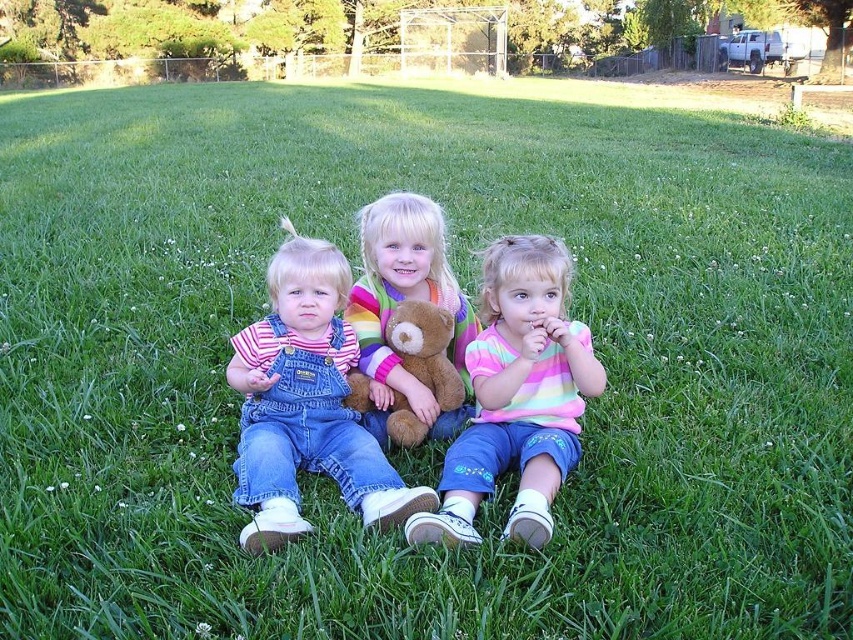
You are a photographer trying to capture a group photo of the children. You want to ensure that both the striped cotton shirt at center and the multicolored striped shirt at center are clearly visible in the photo. Given their distance apart, what is the minimum focal length you should use for your camera lens to ensure both shirts are in focus?

The striped cotton shirt at center is 17.42 inches away from the multicolored striped shirt at center. To ensure both are in focus, the minimum focal length required would depend on the sensor size of the camera and the acceptable circle of confusion. However, a general rule is to use a focal length that provides sufficient depth of field to cover the distance between them. For example, using a 50mm lens with an aperture of f8 might achieve this, but precise calculation requires specific camera sensor data.

You are a photographer standing at the edge of the lawn. You want to take a photo of the denim overalls at center. Where should you aim your camera to capture it?

You should aim your camera at point (306,403) to capture the denim overalls at center.